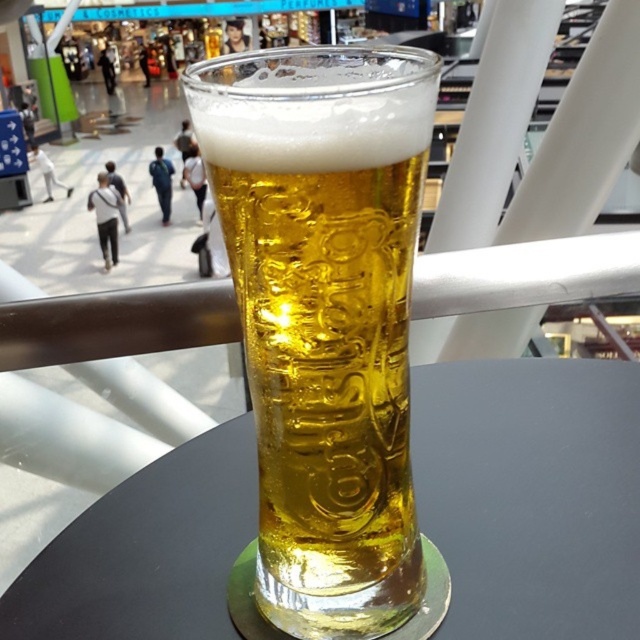
You are at a mall and see two glasses at the center of a table. The translucent glass beer at center and the transparent glass at center. Which one is closer to you?

The translucent glass beer at center is 2.72 inches away from the transparent glass at center, so the transparent glass at center is closer to you since it is positioned closer than the other glass.

You are at a mall and see two glasses on a table. One is a translucent glass beer at center and the other is a transparent glass at center. Which glass is more to the left?

The translucent glass beer at center is more to the left because it is positioned on the left side of the transparent glass at center.